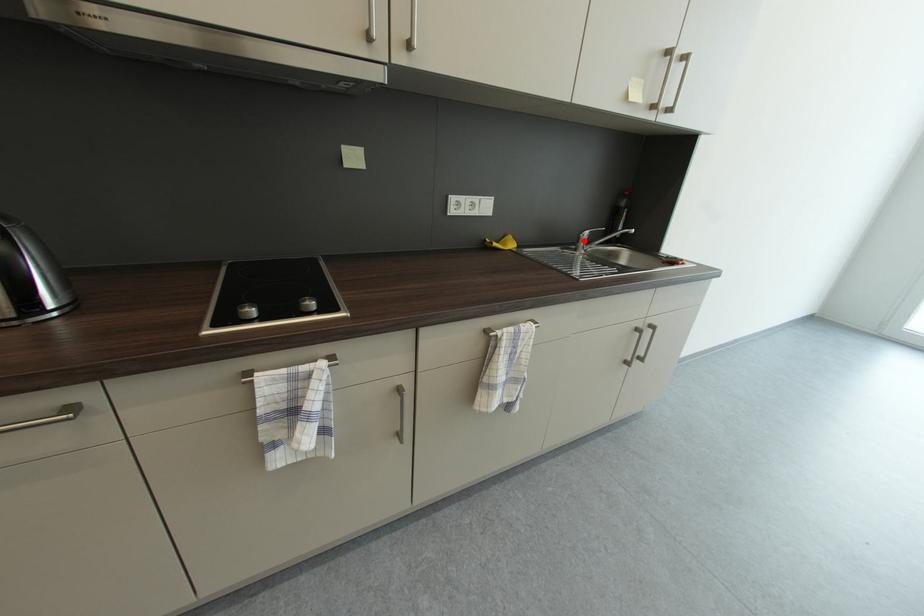
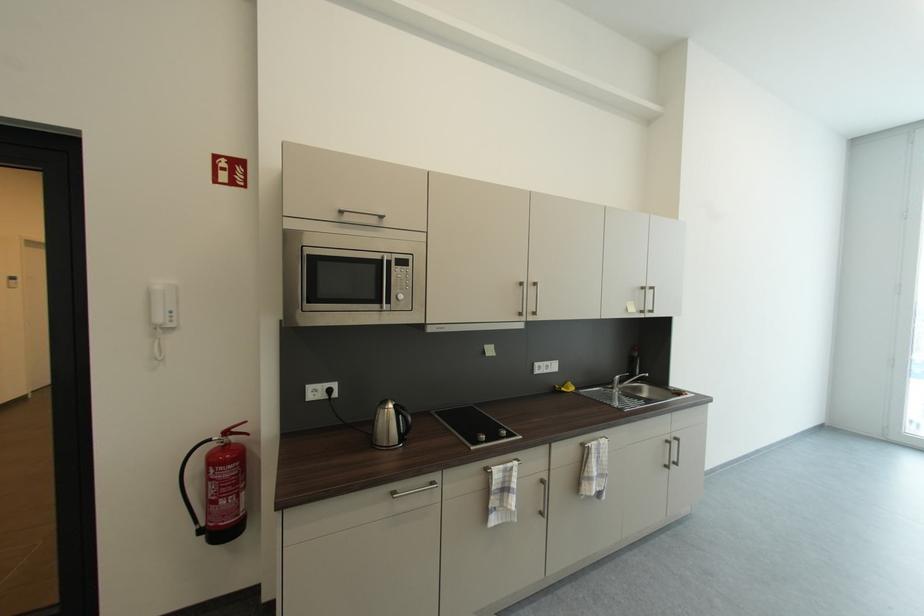
Find the pixel in the second image that matches the highlighted location in the first image.

(618, 383)